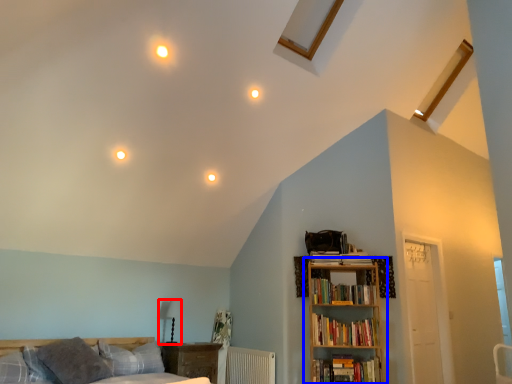
Question: Which object is further to the camera taking this photo, table lamp (highlighted by a red box) or bookcase (highlighted by a blue box)?

Choices:
 (A) table lamp
 (B) bookcase

Answer: (A)